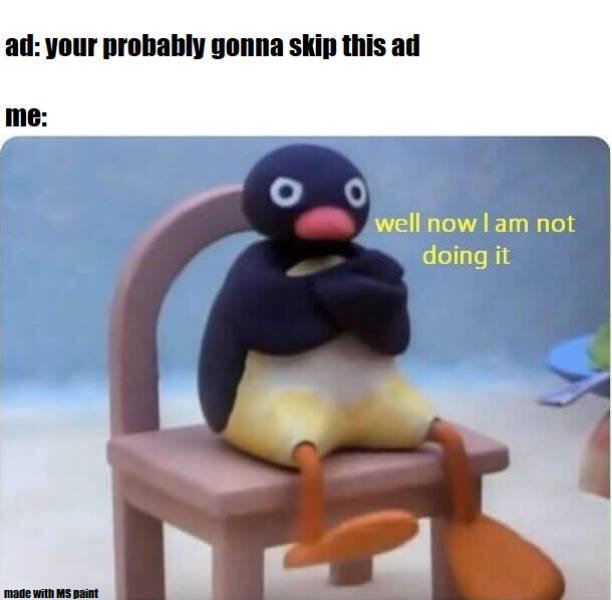
Image resolution: width=612 pixels, height=600 pixels. What are the coordinates of `brown chair` in the screenshot? It's located at (211, 483).